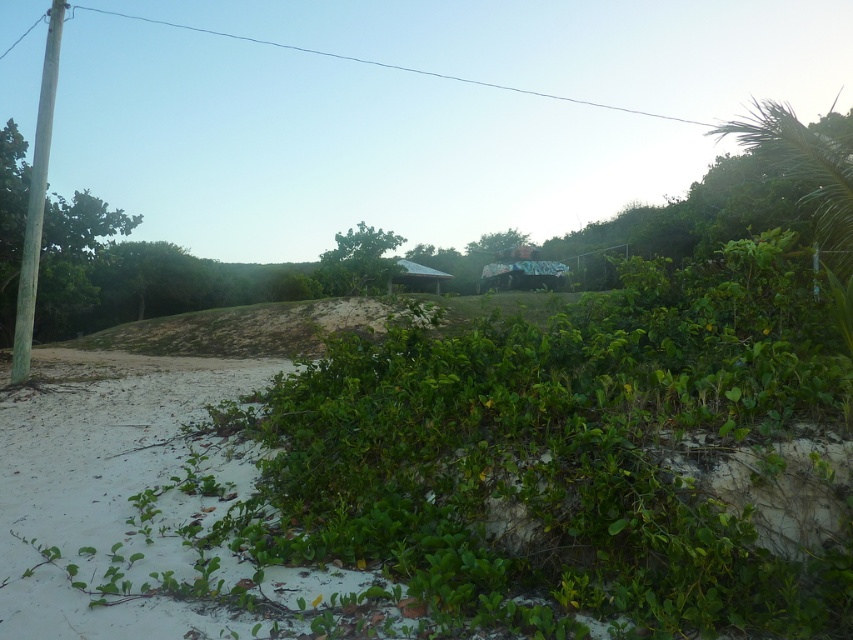
Question: In this image, where is smooth gray pole at left located relative to green leafy bush at center?

Choices:
 (A) above
 (B) below

Answer: (B)

Question: Which point is closer to the camera?

Choices:
 (A) (375, 248)
 (B) (42, 145)

Answer: (B)

Question: Can you confirm if smooth gray pole at left is positioned above green leafy bush at center?

Choices:
 (A) no
 (B) yes

Answer: (A)

Question: Among these objects, which one is nearest to the camera?

Choices:
 (A) smooth gray pole at left
 (B) green leafy bush at center

Answer: (A)

Question: Among these points, which one is farthest from the camera?

Choices:
 (A) (32, 164)
 (B) (360, 284)

Answer: (B)

Question: Is the position of smooth gray pole at left less distant than that of green leafy bush at center?

Choices:
 (A) no
 (B) yes

Answer: (B)